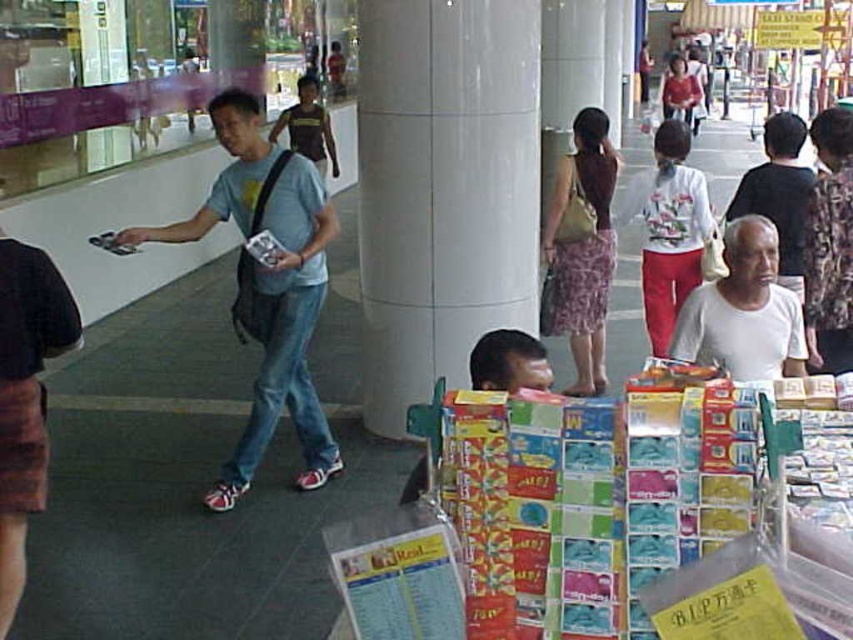
You are organizing a clothing display and need to place the white matte shirt at center and the brown textured shirt at center side by side. Based on their descriptions, which shirt should you place on the left to ensure they fit within a 1.2 meter wide display area?

The white matte shirt at center is thinner than the brown textured shirt at center. To fit within the 1.2 meter display area, place the thinner white matte shirt at center on the left and the thicker brown textured shirt at center on the right, ensuring they both fit side by side.

You are standing at the entrance of the mall and see a man in a light blue T shirt walking towards the vendor stall. Where exactly is the light blue T shirt located in relation to the point marked at coordinates (267, 284)?

The point marked at coordinates (267, 284) indicates the exact location of the light blue T shirt at center.